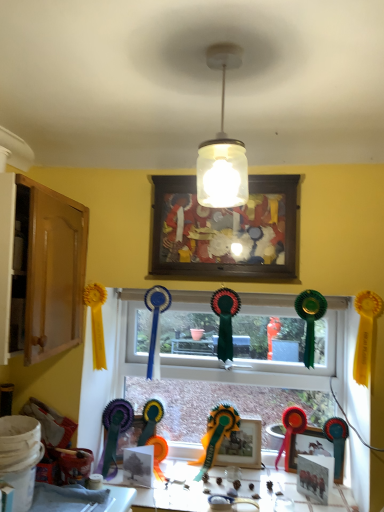
Find the location of `spots to the right of matte white picture frame at lower center, which is the third picture frame from back to front`. spots to the right of matte white picture frame at lower center, which is the third picture frame from back to front is located at coordinates (344, 500).